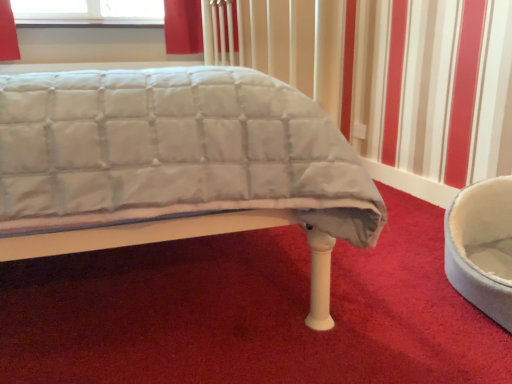
The width and height of the screenshot is (512, 384). I want to click on white quilted fabric bed at center, so click(x=175, y=164).

What do you see at coordinates (175, 164) in the screenshot? I see `white quilted fabric bed at center` at bounding box center [175, 164].

This screenshot has width=512, height=384. What do you see at coordinates (482, 247) in the screenshot?
I see `white plush bean bag at right` at bounding box center [482, 247].

You are a GUI agent. You are given a task and a screenshot of the screen. Output one action in this format:
    pyautogui.click(x=<x>, y=<y>)
    Task: Click on the white plush bean bag at right
    Image resolution: width=512 pixels, height=384 pixels.
    Given the screenshot: What is the action you would take?
    pyautogui.click(x=482, y=247)

The height and width of the screenshot is (384, 512). Identify the location of white quilted fabric bed at center. (175, 164).

In the image, is white quilted fabric bed at center on the left side or the right side of white plush bean bag at right?

Clearly, white quilted fabric bed at center is on the left of white plush bean bag at right in the image.

Is white quilted fabric bed at center in front of or behind white plush bean bag at right in the image?

Visually, white quilted fabric bed at center is located in front of white plush bean bag at right.

Considering the positions of points (212, 210) and (465, 191), is point (212, 210) farther from camera compared to point (465, 191)?

No, it is not.

From the image's perspective, is white quilted fabric bed at center positioned above or below white plush bean bag at right?

Based on their image positions, white quilted fabric bed at center is located above white plush bean bag at right.

From a real-world perspective, is white quilted fabric bed at center physically located above or below white plush bean bag at right?

From a real-world perspective, white quilted fabric bed at center is physically above white plush bean bag at right.

Which object is wider, white quilted fabric bed at center or white plush bean bag at right?

Wider between the two is white quilted fabric bed at center.

Considering the relative sizes of white quilted fabric bed at center and white plush bean bag at right in the image provided, is white quilted fabric bed at center taller than white plush bean bag at right?

Yes.

Between white quilted fabric bed at center and white plush bean bag at right, which one has larger size?

With larger size is white quilted fabric bed at center.

Is white plush bean bag at right a part of white quilted fabric bed at center?

No, white plush bean bag at right is located outside of white quilted fabric bed at center.

Are white quilted fabric bed at center and white plush bean bag at right beside each other?

No, white quilted fabric bed at center is not in contact with white plush bean bag at right.

Is white quilted fabric bed at center oriented away from white plush bean bag at right?

That's not correct — white quilted fabric bed at center is not looking away from white plush bean bag at right.

This screenshot has height=384, width=512. What are the coordinates of `bed lying on the left of white plush bean bag at right` in the screenshot? It's located at (175, 164).

Would you say white plush bean bag at right is to the left or to the right of white quilted fabric bed at center in the picture?

white plush bean bag at right is positioned on white quilted fabric bed at center's right side.

Who is more distant, white plush bean bag at right or white quilted fabric bed at center?

Positioned behind is white plush bean bag at right.

Which is farther from the camera, (x=509, y=205) or (x=197, y=169)?

Positioned behind is point (x=509, y=205).

From the image's perspective, is white plush bean bag at right below white quilted fabric bed at center?

Correct, white plush bean bag at right appears lower than white quilted fabric bed at center in the image.

From a real-world perspective, between white plush bean bag at right and white quilted fabric bed at center, who is vertically higher?

white quilted fabric bed at center.

From the picture: Does white plush bean bag at right have a greater width compared to white quilted fabric bed at center?

No.

In terms of height, does white plush bean bag at right look taller or shorter compared to white quilted fabric bed at center?

white plush bean bag at right is shorter than white quilted fabric bed at center.

Considering the sizes of objects white plush bean bag at right and white quilted fabric bed at center in the image provided, who is bigger, white plush bean bag at right or white quilted fabric bed at center?

With larger size is white quilted fabric bed at center.

Is white plush bean bag at right located outside white quilted fabric bed at center?

That's correct, white plush bean bag at right is outside of white quilted fabric bed at center.

Is white plush bean bag at right placed right next to white quilted fabric bed at center?

There is a gap between white plush bean bag at right and white quilted fabric bed at center.

From the picture: Is white plush bean bag at right aimed at white quilted fabric bed at center?

Yes, white plush bean bag at right is facing white quilted fabric bed at center.

This screenshot has width=512, height=384. What are the coordinates of `bed above the white plush bean bag at right (from a real-world perspective)` in the screenshot? It's located at (175, 164).

Find the location of `bed in front of the white plush bean bag at right`. bed in front of the white plush bean bag at right is located at coordinates (175, 164).

Find the location of a particular element. This screenshot has width=512, height=384. bean bag chair located behind the white quilted fabric bed at center is located at coordinates [482, 247].